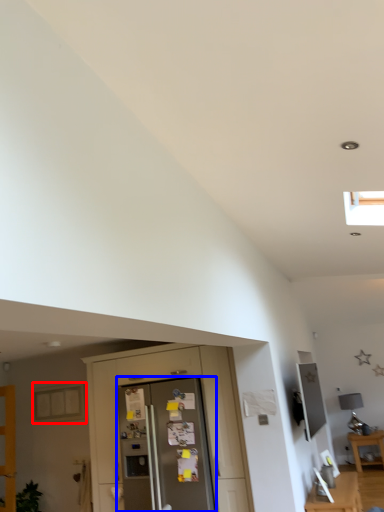
Question: Which object appears closest to the camera in this image, window (highlighted by a red box) or screen door (highlighted by a blue box)?

Choices:
 (A) window
 (B) screen door

Answer: (B)